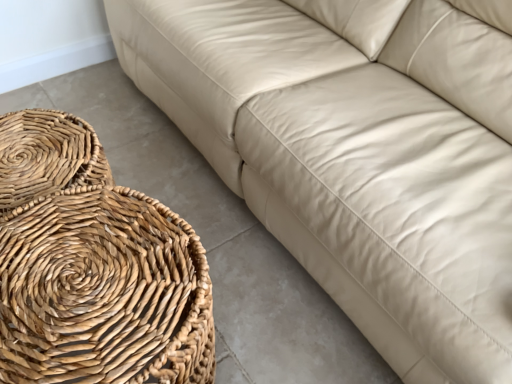
Image resolution: width=512 pixels, height=384 pixels. Find the location of `vacant point above natural woven wood round table at lower left (from a real-world perspective)`. vacant point above natural woven wood round table at lower left (from a real-world perspective) is located at coordinates (86, 274).